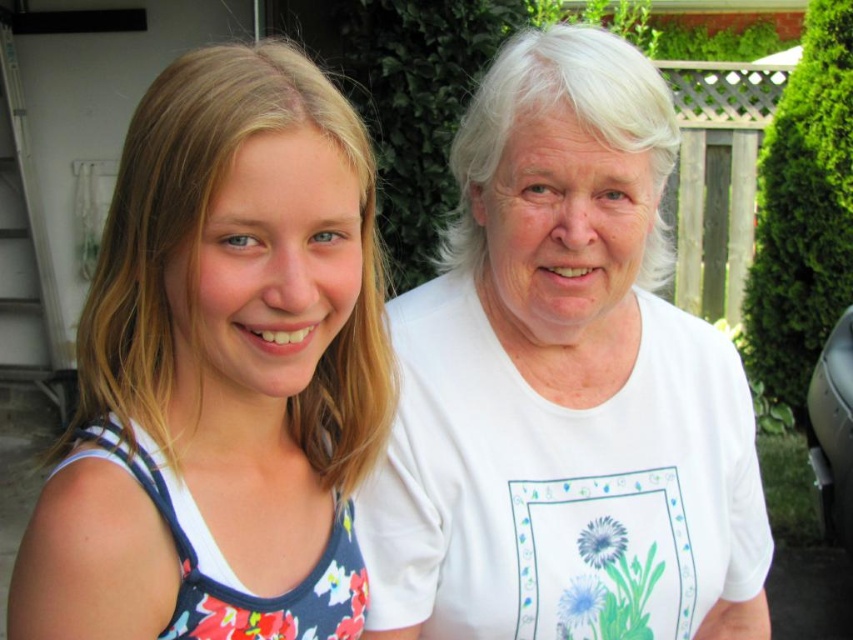
You are planning to wear either the floral fabric dress at left or the floral fabric tank top at left for an event. Considering their sizes, which one would you choose if you want something wider?

The floral fabric dress at left has a larger width than the floral fabric tank top at left, so you should choose the floral fabric dress at left if you want something wider.

You are standing in a backyard and see two people. The young girl is wearing a sleeveless top with a floral pattern in shades of red, white, and blue, and the older woman is wearing a plain white T shirt with a simple graphic design of flowers and leaves. There is a point marked at coordinates (221, 371). Which person is closer to that point?

The floral fabric dress at left is located at point (221, 371), so the young girl on the left is closer to that point.